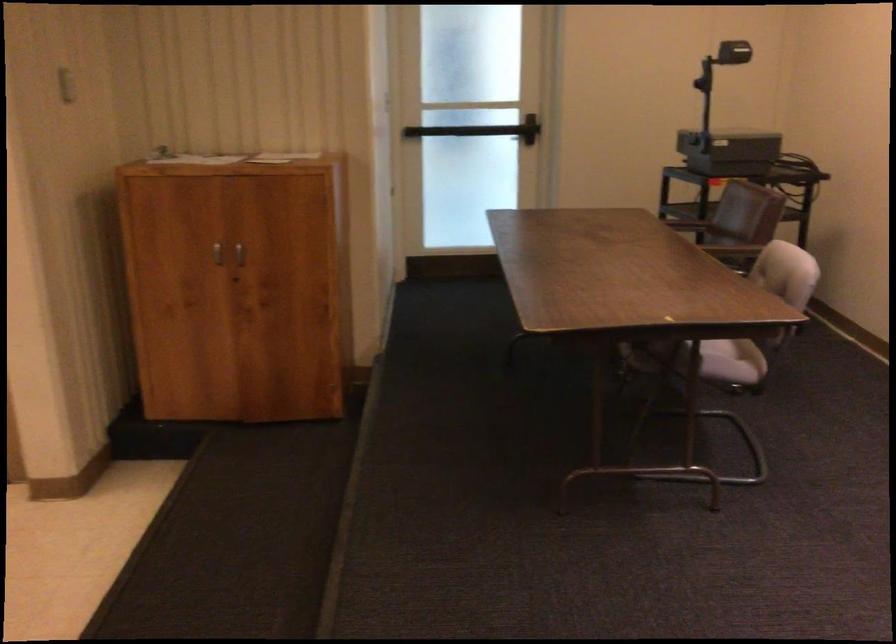
The width and height of the screenshot is (896, 644). What do you see at coordinates (737, 348) in the screenshot? I see `the gray chair sitting surface` at bounding box center [737, 348].